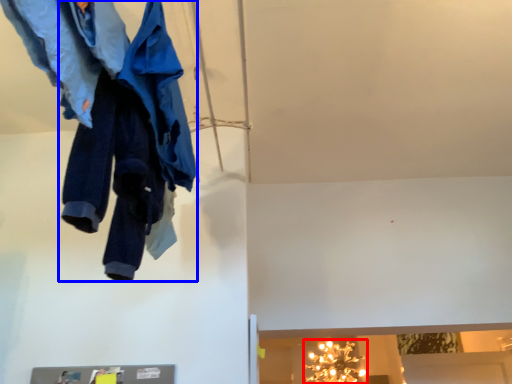
Question: Which point is closer to the camera, light fixture (highlighted by a red box) or trousers (highlighted by a blue box)?

Choices:
 (A) light fixture
 (B) trousers

Answer: (B)